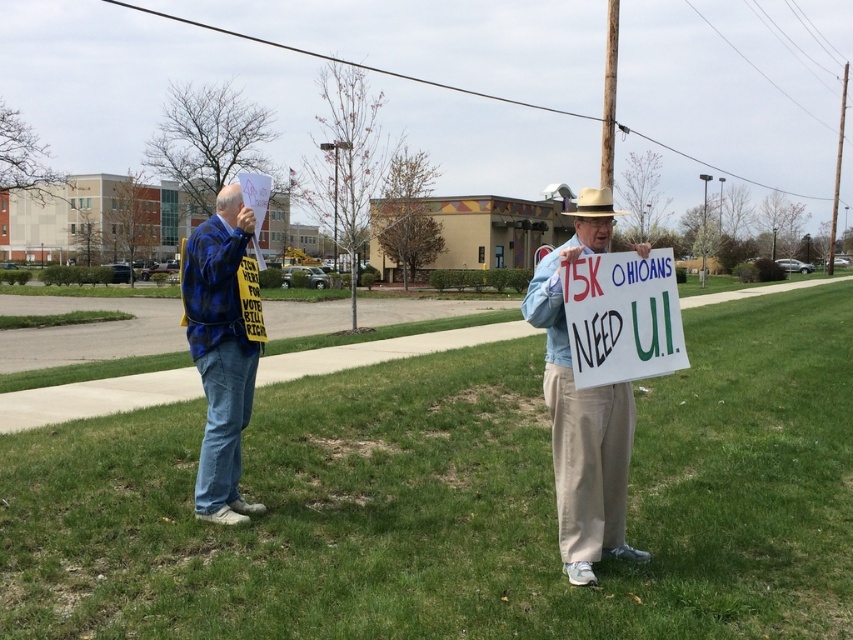
Question: Which object is closer to the camera taking this photo?

Choices:
 (A) denim jacket at center
 (B) brown felt cowboy hat at center

Answer: (A)

Question: Based on their relative distances, which object is farther from the denim jacket at center?

Choices:
 (A) blue plaid shirt at left
 (B) white cardboard sign at center
 (C) brown felt cowboy hat at center

Answer: (C)

Question: Can you confirm if blue plaid shirt at left is smaller than white cardboard sign at center?

Choices:
 (A) yes
 (B) no

Answer: (B)

Question: Which object appears farthest from the camera in this image?

Choices:
 (A) blue plaid shirt at left
 (B) denim jacket at center
 (C) brown felt cowboy hat at center

Answer: (A)

Question: Does white cardboard sign at center have a greater width compared to brown felt cowboy hat at center?

Choices:
 (A) yes
 (B) no

Answer: (B)

Question: Does white cardboard sign at center have a lesser width compared to brown felt cowboy hat at center?

Choices:
 (A) no
 (B) yes

Answer: (B)